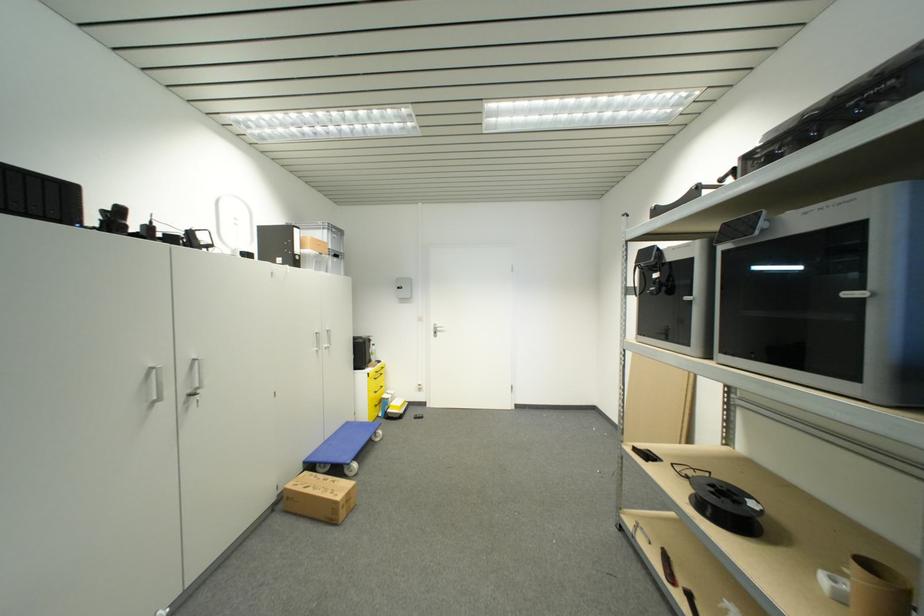
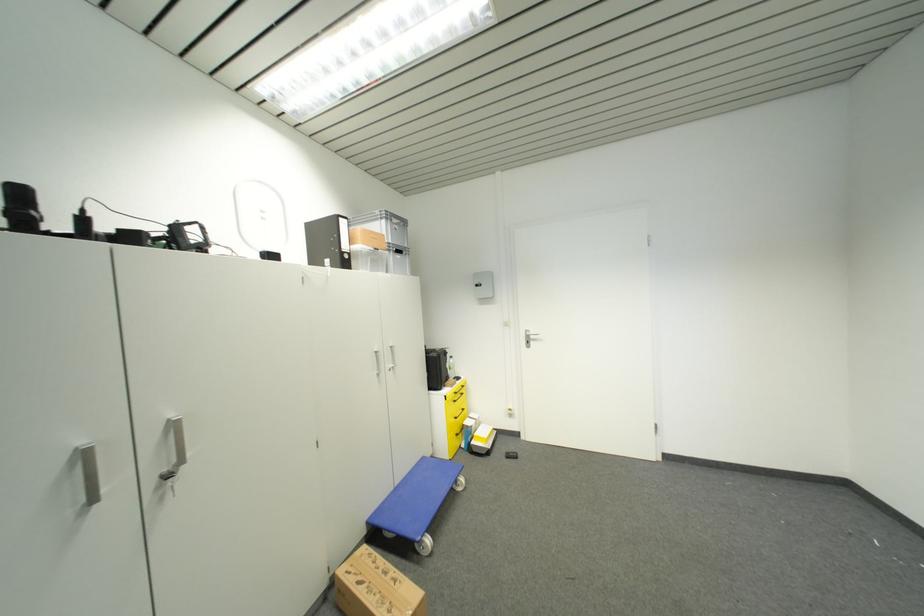
Question: The camera is either moving clockwise (left) or counter-clockwise (right) around the object. The first image is from the beginning of the video and the second image is from the end. Is the camera moving left or right when shooting the video?

Choices:
 (A) Left
 (B) Right

Answer: (B)